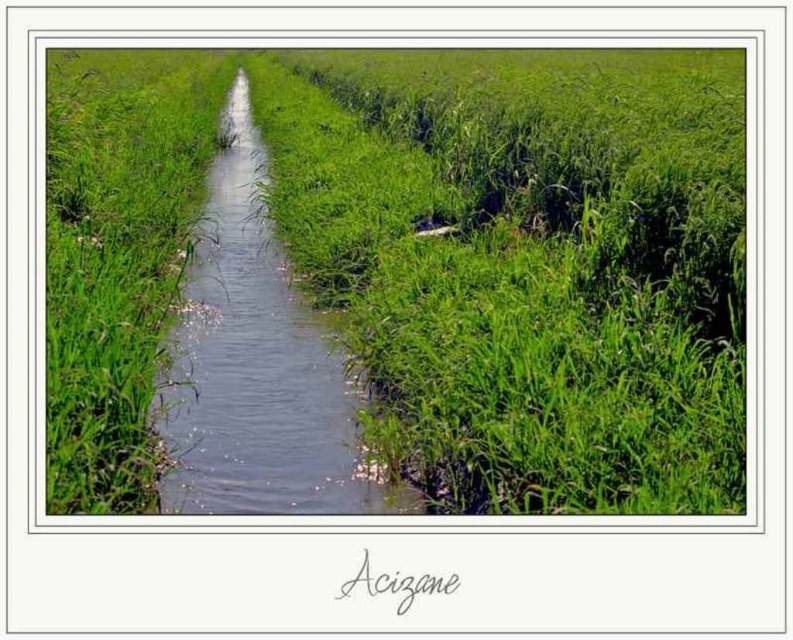
You are a hiker trying to cross the stream. You notice the green grass at center and the clear water stream at center. Which one is wider in terms of their width?

The green grass at center is wider than the clear water stream at center.

You are a gardener planning to plant new flowers in the green grass at center and clear water stream at center. Which area has more space available for planting?

The green grass at center has more space available for planting since it is larger in size than the clear water stream at center.

You are standing at the origin point of the image. Which direction should you move to reach the green grass at center?

The green grass at center is located at point 0.405 on the x axis and 0.552 on the y axis. Since you are at the origin, you should move right along the x axis and up along the y axis to reach it.